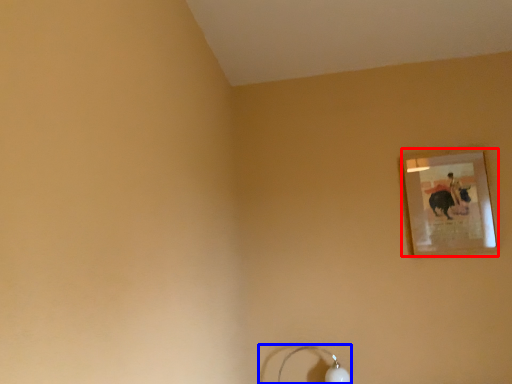
Question: Which point is further to the camera, picture frame (highlighted by a red box) or lamp (highlighted by a blue box)?

Choices:
 (A) picture frame
 (B) lamp

Answer: (A)